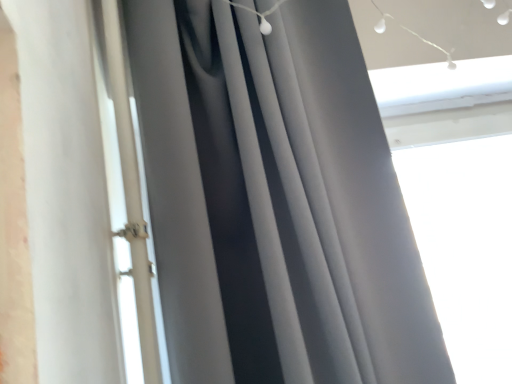
You are a GUI agent. You are given a task and a screenshot of the screen. Output one action in this format:
    pyautogui.click(x=<x>, y=<y>)
    Task: Click on the matte gray curtain at center
    This screenshot has height=384, width=512.
    Given the screenshot: What is the action you would take?
    pyautogui.click(x=276, y=201)

This screenshot has width=512, height=384. Describe the element at coordinates (276, 201) in the screenshot. I see `matte gray curtain at center` at that location.

Identify the location of matte gray curtain at center. Image resolution: width=512 pixels, height=384 pixels. (276, 201).